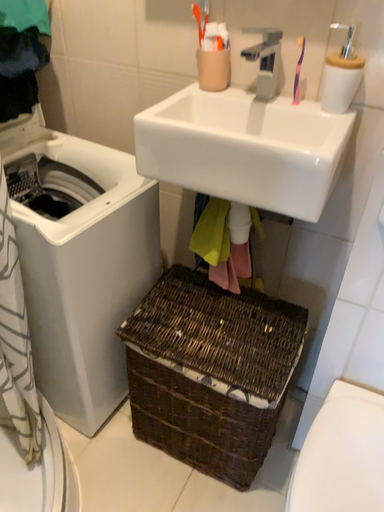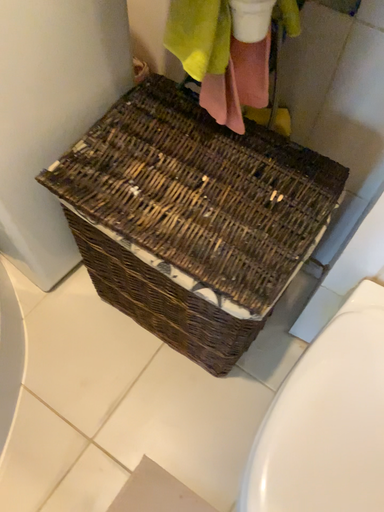
Question: Which way did the camera rotate in the video?

Choices:
 (A) rotated upward
 (B) rotated downward

Answer: (B)